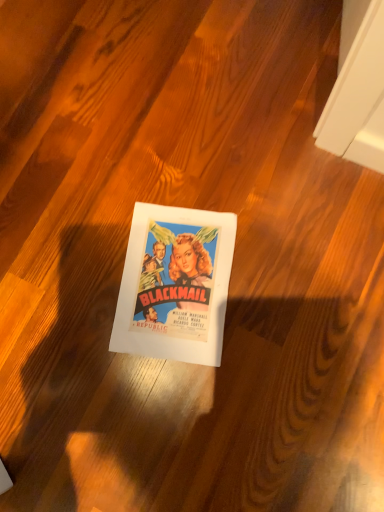
What do you see at coordinates (175, 284) in the screenshot? This screenshot has width=384, height=512. I see `white paper poster at center` at bounding box center [175, 284].

Find the location of a particular element. This screenshot has height=512, width=384. white paper poster at center is located at coordinates (175, 284).

This screenshot has height=512, width=384. I want to click on white paper poster at center, so click(175, 284).